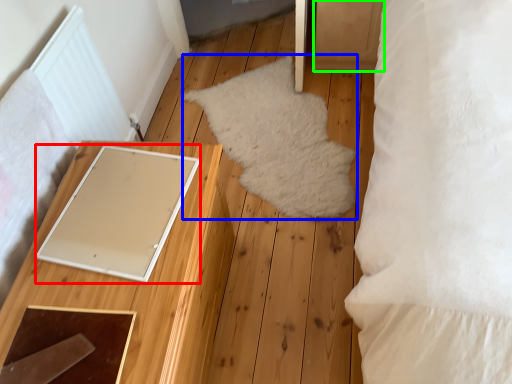
Question: Which object is the closest to the pad (highlighted by a red box)? Choose among these: mat (highlighted by a blue box) or drawer (highlighted by a green box).

Choices:
 (A) mat
 (B) drawer

Answer: (A)